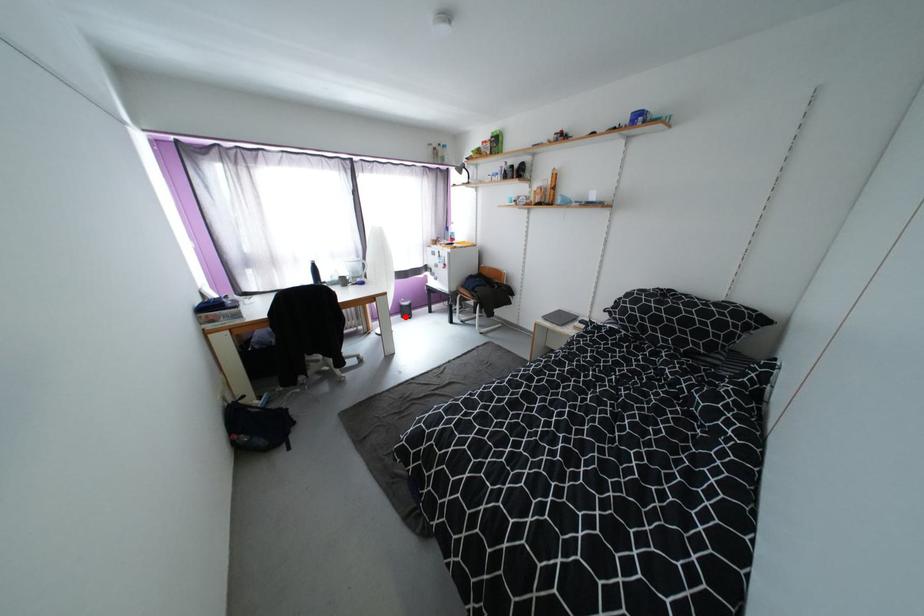
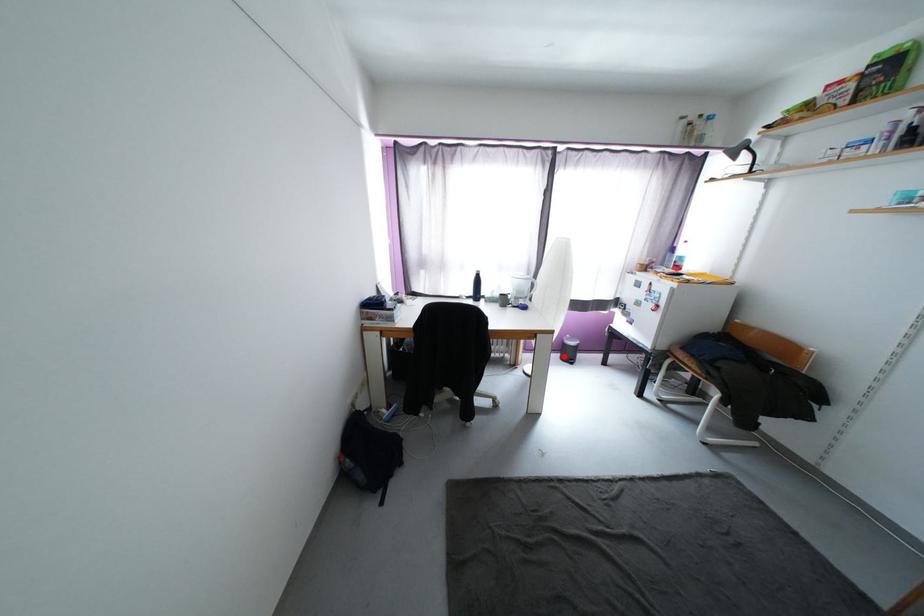
I am providing you with two images of the same scene from different viewpoints. A red point is marked on the first image and another point is marked on the second image. Does the point marked in image1 correspond to the same location as the one in image2?

Yes